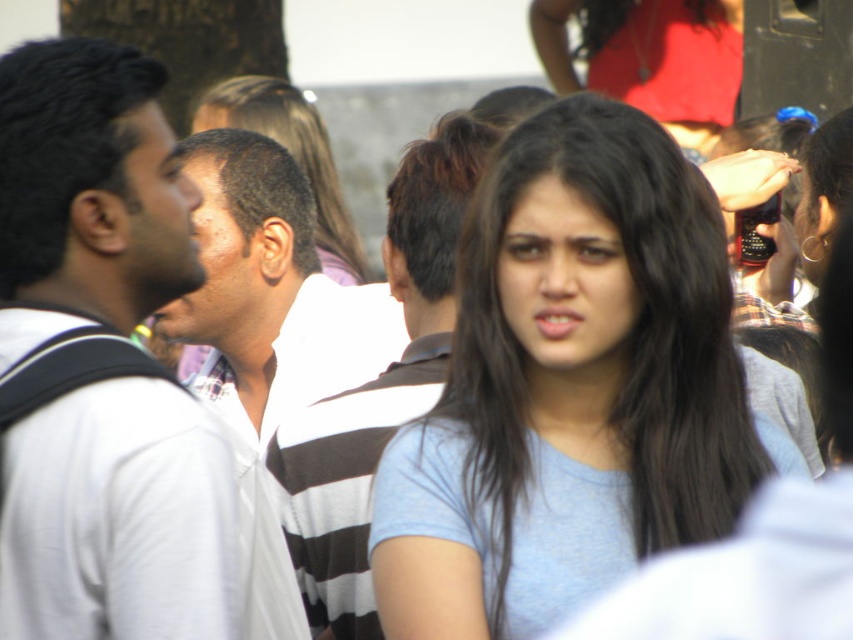
Question: Does white matte shirt at left have a greater width compared to smooth brown hair at center?

Choices:
 (A) yes
 (B) no

Answer: (A)

Question: Which object is farther from the camera taking this photo?

Choices:
 (A) smooth brown hair at center
 (B) white matte shirt at left
 (C) light blue cotton shirt at center
 (D) white striped shirt at left

Answer: (A)

Question: Which point appears closest to the camera in this image?

Choices:
 (A) (602, 547)
 (B) (257, 429)

Answer: (A)

Question: Is light blue cotton shirt at center to the left of striped shirt at center from the viewer's perspective?

Choices:
 (A) no
 (B) yes

Answer: (A)

Question: Is white matte shirt at left to the left of striped shirt at center from the viewer's perspective?

Choices:
 (A) no
 (B) yes

Answer: (B)

Question: Which is farther from the smooth brown hair at center?

Choices:
 (A) white matte shirt at left
 (B) white striped shirt at left

Answer: (A)